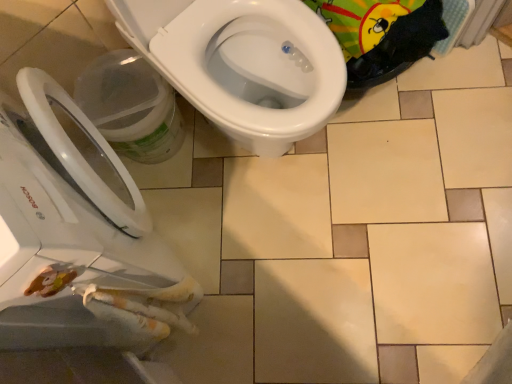
Question: Should I look upward or downward to see white glossy toilet at upper center?

Choices:
 (A) up
 (B) down

Answer: (B)

Question: Considering the relative positions of white glossy toilet at upper center and transparent plastic bucket at lower left in the image provided, is white glossy toilet at upper center to the right of transparent plastic bucket at lower left from the viewer's perspective?

Choices:
 (A) no
 (B) yes

Answer: (A)

Question: From the image's perspective, is white glossy toilet at upper center located above transparent plastic bucket at lower left?

Choices:
 (A) no
 (B) yes

Answer: (A)

Question: Is white glossy toilet at upper center beside transparent plastic bucket at lower left?

Choices:
 (A) no
 (B) yes

Answer: (A)

Question: Considering the relative sizes of white glossy toilet at upper center and transparent plastic bucket at lower left in the image provided, is white glossy toilet at upper center shorter than transparent plastic bucket at lower left?

Choices:
 (A) no
 (B) yes

Answer: (A)

Question: Is white glossy toilet at upper center aimed at transparent plastic bucket at lower left?

Choices:
 (A) no
 (B) yes

Answer: (B)

Question: From a real-world perspective, is white glossy toilet at upper center positioned under transparent plastic bucket at lower left based on gravity?

Choices:
 (A) yes
 (B) no

Answer: (B)

Question: From a real-world perspective, does transparent plastic bucket at lower left sit lower than white glossy toilet at upper center?

Choices:
 (A) yes
 (B) no

Answer: (A)

Question: Can you confirm if transparent plastic bucket at lower left is wider than white glossy toilet at upper center?

Choices:
 (A) no
 (B) yes

Answer: (A)

Question: Is transparent plastic bucket at lower left positioned behind white glossy toilet at upper center?

Choices:
 (A) no
 (B) yes

Answer: (B)

Question: Considering the relative sizes of transparent plastic bucket at lower left and white glossy toilet at upper center in the image provided, is transparent plastic bucket at lower left bigger than white glossy toilet at upper center?

Choices:
 (A) yes
 (B) no

Answer: (B)

Question: Is transparent plastic bucket at lower left smaller than white glossy toilet at upper center?

Choices:
 (A) yes
 (B) no

Answer: (A)

Question: From a real-world perspective, is transparent plastic bucket at lower left positioned over white glossy toilet at upper center based on gravity?

Choices:
 (A) yes
 (B) no

Answer: (B)

Question: Considering the relative sizes of transparent plastic bucket at lower left and white glossy bidet at center in the image provided, is transparent plastic bucket at lower left taller than white glossy bidet at center?

Choices:
 (A) yes
 (B) no

Answer: (B)